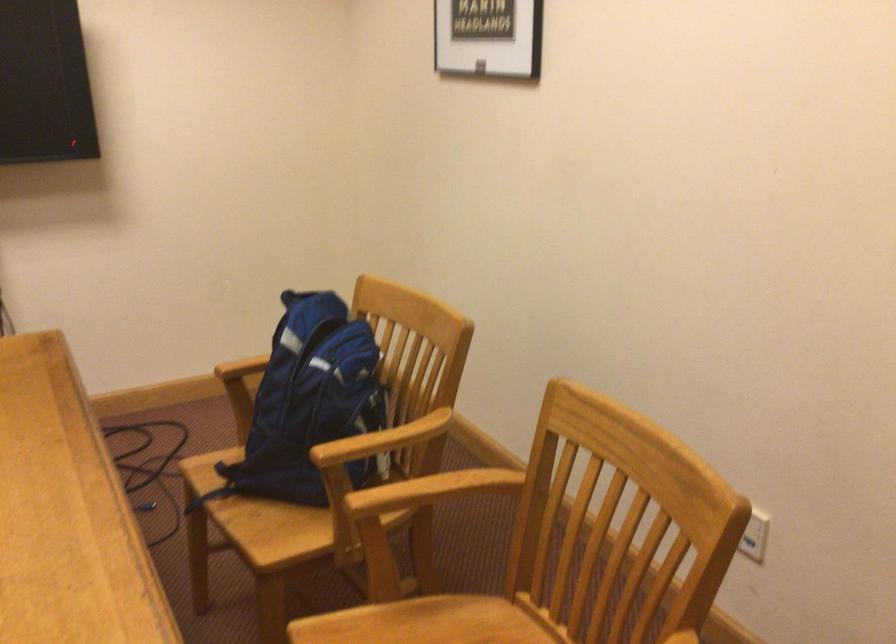
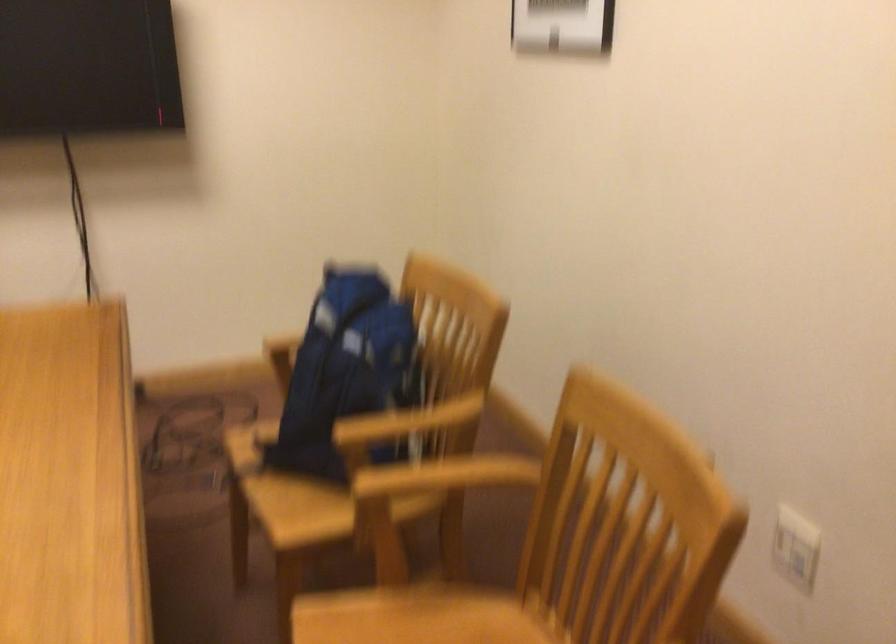
Question: The camera is either moving clockwise (left) or counter-clockwise (right) around the object. The first image is from the beginning of the video and the second image is from the end. Is the camera moving left or right when shooting the video?

Choices:
 (A) Left
 (B) Right

Answer: (B)